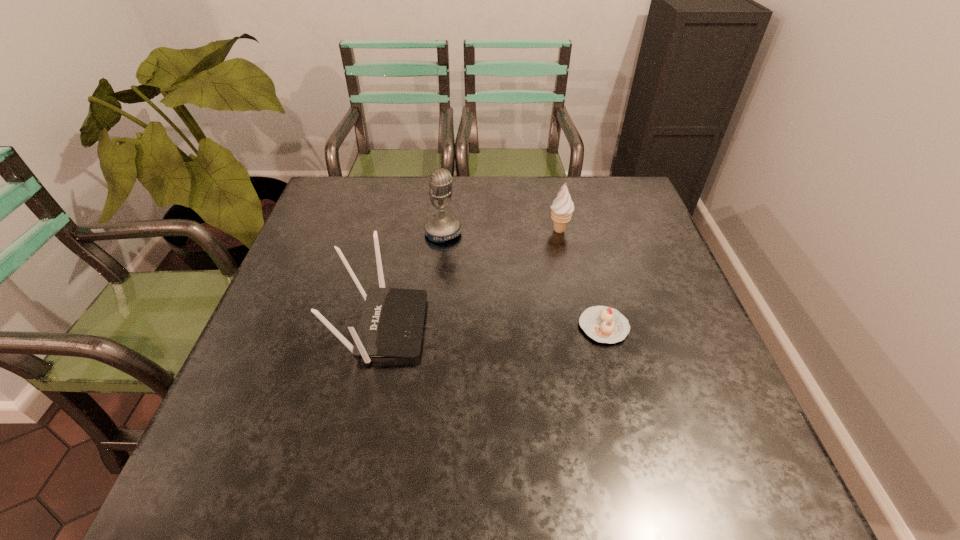
Locate an element on the screen. Image resolution: width=960 pixels, height=540 pixels. free space located on the front-facing side of the icecream is located at coordinates (496, 319).

Find the location of a particular element. This screenshot has width=960, height=540. vacant space situated on the front-facing side of the icecream is located at coordinates (534, 266).

Identify the location of object at the right edge. pyautogui.click(x=603, y=324).

This screenshot has height=540, width=960. In the image, there is a desktop. In order to click on vacant space at the far edge in this screenshot , I will do `click(383, 189)`.

This screenshot has width=960, height=540. I want to click on vacant area at the near edge, so click(x=326, y=416).

Identify the location of vacant region at the left edge of the desktop. The height and width of the screenshot is (540, 960). (300, 260).

The image size is (960, 540). Find the location of `vacant space at the right edge`. vacant space at the right edge is located at coordinates (710, 360).

What are the coordinates of `free point at the far left corner` in the screenshot? It's located at (358, 184).

You are a GUI agent. You are given a task and a screenshot of the screen. Output one action in this format:
    pyautogui.click(x=<x>, y=<y>)
    Task: Click on the free point between the icecream and the router
    Image resolution: width=960 pixels, height=540 pixels.
    Given the screenshot: What is the action you would take?
    pyautogui.click(x=470, y=279)

I want to click on vacant area that lies between the microphone and the router, so click(x=413, y=280).